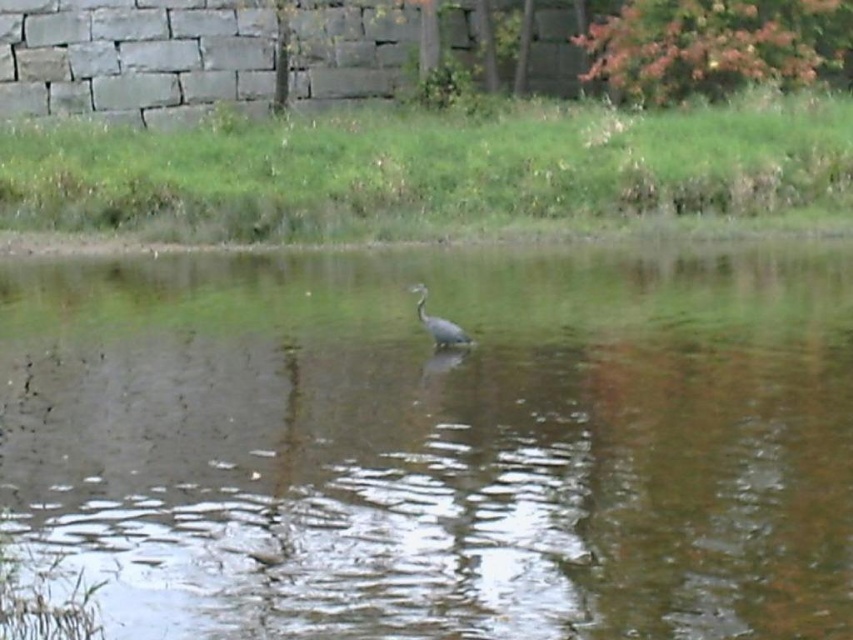
You are a photographer trying to capture the gray matte bird at center in the image. The brown murky water at center is in the way. Can you adjust your camera angle to focus on the bird without the water obstructing the view?

The brown murky water at center is above the gray matte bird at center, so adjusting the camera angle downward might allow focusing on the bird while minimizing the water obstruction.

You are standing at the point with coordinates point (415, 288) and want to walk to the point with coordinates point (358, 369). Which direction should you move to reach your destination?

You should move forward because point (358, 369) is in front of point (415, 288).

You are a photographer trying to capture the reflection of the gray matte bird at center in the brown murky water at center. Based on the scene description, will the bird be clearly visible in the water?

The brown murky water at center is in front of the gray matte bird at center, so the bird is not submerged in the water. Therefore, its reflection may not be clear or might not exist because the bird is standing above the water surface.